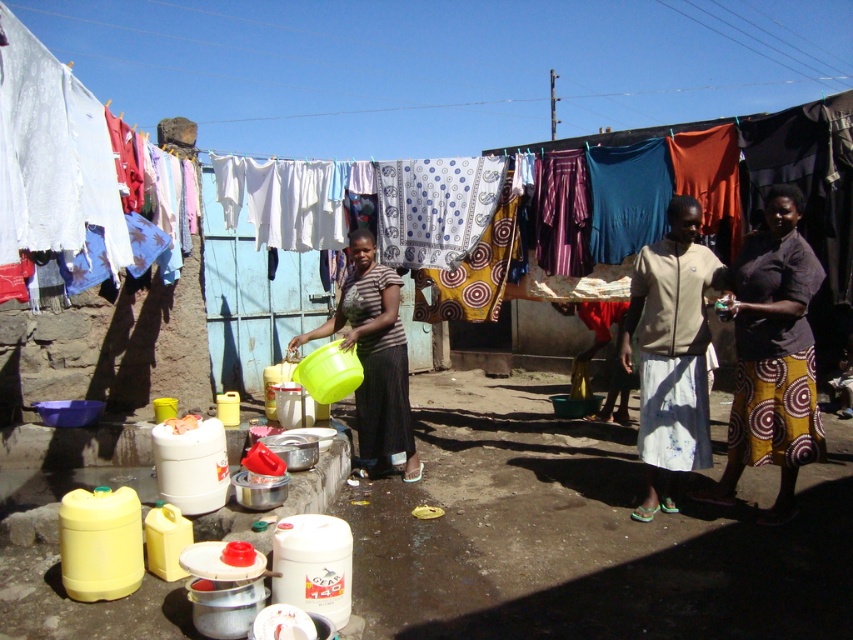
Question: Which point appears farthest from the camera in this image?

Choices:
 (A) (796, 404)
 (B) (368, 316)

Answer: (B)

Question: Is beige fabric skirt at center bigger than matte green plastic bucket at center?

Choices:
 (A) no
 (B) yes

Answer: (A)

Question: Which point is closer to the camera?

Choices:
 (A) yellow printed skirt at right
 (B) matte green plastic bucket at center

Answer: (A)

Question: Which of the following is the farthest from the observer?

Choices:
 (A) beige fabric skirt at center
 (B) yellow printed skirt at right
 (C) matte green plastic bucket at center

Answer: (C)

Question: Can you confirm if beige fabric skirt at center is smaller than matte green plastic bucket at center?

Choices:
 (A) no
 (B) yes

Answer: (B)

Question: Can you confirm if yellow printed skirt at right is positioned to the right of matte green plastic bucket at center?

Choices:
 (A) yes
 (B) no

Answer: (A)